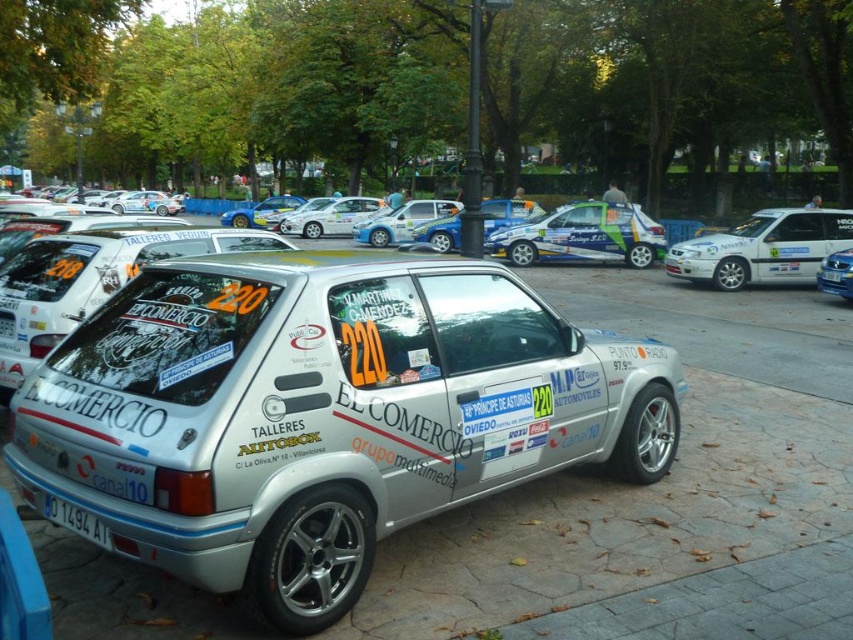
Which is behind, point (604, 241) or point (425, 205)?

The point (425, 205) is more distant.

Who is lower down, white glossy car at center or matte silver hatchback at center?

white glossy car at center is below.

The width and height of the screenshot is (853, 640). Find the location of `white glossy car at center`. white glossy car at center is located at coordinates (582, 236).

Does matte silver hatchback at center have a lesser height compared to metallic blue hatchback at center?

Yes, matte silver hatchback at center is shorter than metallic blue hatchback at center.

Is point (383, 225) closer to viewer compared to point (840, 252)?

No, it is behind (840, 252).

Describe the element at coordinates (402, 221) in the screenshot. I see `matte silver hatchback at center` at that location.

I want to click on matte silver hatchback at center, so click(x=402, y=221).

From the picture: Between white metallic car at center and white plastic license plate at lower left, which one has more height?

white metallic car at center is taller.

Can you confirm if white metallic car at center is positioned below white plastic license plate at lower left?

Actually, white metallic car at center is above white plastic license plate at lower left.

This screenshot has height=640, width=853. What do you see at coordinates (323, 412) in the screenshot? I see `white metallic car at center` at bounding box center [323, 412].

The image size is (853, 640). Find the location of `white metallic car at center`. white metallic car at center is located at coordinates 323,412.